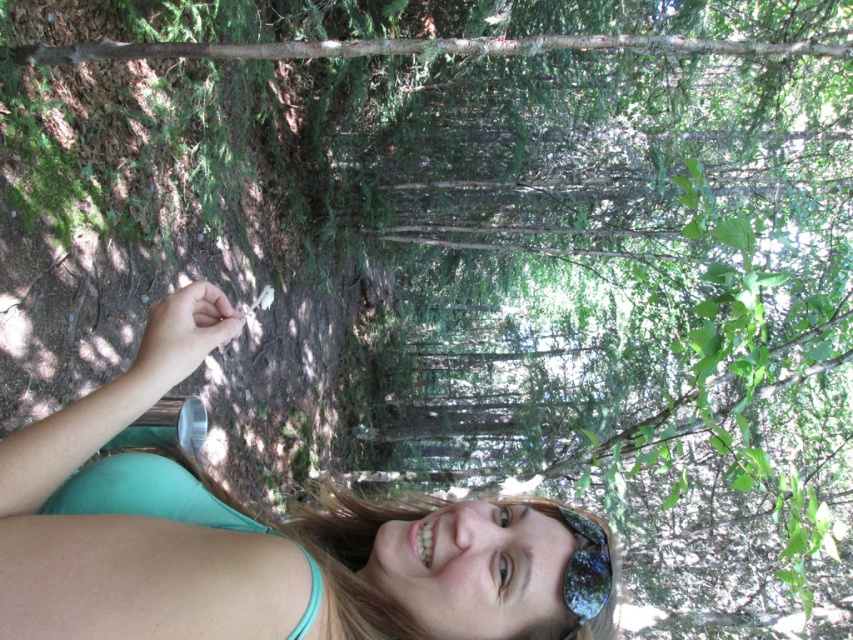
Question: Which is farther from the green fabric shirt at lower left?

Choices:
 (A) shiny reflective sunglasses at lower center
 (B) teal fabric bikini top at lower left

Answer: (A)

Question: Which of these objects is positioned farthest from the shiny reflective sunglasses at lower center?

Choices:
 (A) teal fabric bikini top at lower left
 (B) green fabric shirt at lower left

Answer: (A)

Question: Which object is the closest to the shiny reflective sunglasses at lower center?

Choices:
 (A) green fabric shirt at lower left
 (B) teal fabric bikini top at lower left

Answer: (A)

Question: Can you confirm if green fabric shirt at lower left is smaller than teal fabric bikini top at lower left?

Choices:
 (A) no
 (B) yes

Answer: (A)

Question: Is green fabric shirt at lower left bigger than teal fabric bikini top at lower left?

Choices:
 (A) yes
 (B) no

Answer: (A)

Question: Considering the relative positions of green fabric shirt at lower left and teal fabric bikini top at lower left in the image provided, where is green fabric shirt at lower left located with respect to teal fabric bikini top at lower left?

Choices:
 (A) left
 (B) right

Answer: (B)